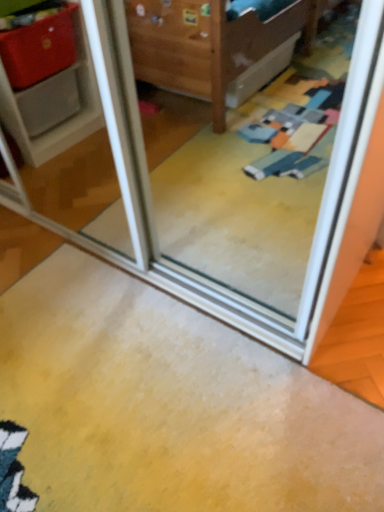
Where is `transparent glass screen door at center`? transparent glass screen door at center is located at coordinates (232, 185).

What do you see at coordinates (232, 185) in the screenshot? I see `transparent glass screen door at center` at bounding box center [232, 185].

Measure the distance between point (117,136) and camera.

Point (117,136) and camera are 1.12 meters apart from each other.

This screenshot has height=512, width=384. What are the coordinates of `transparent glass screen door at center` in the screenshot? It's located at (232, 185).